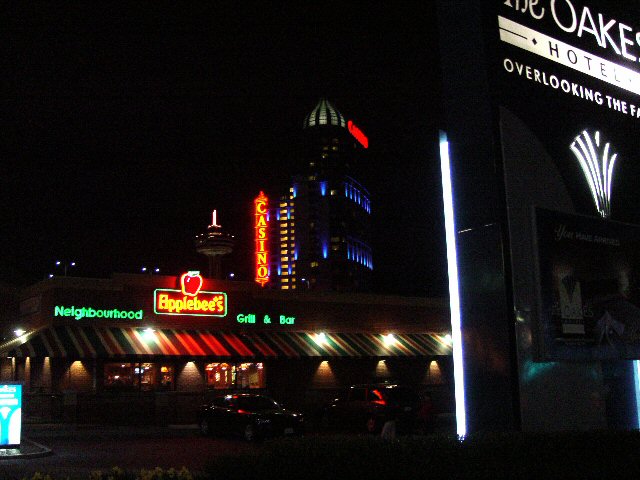
Image resolution: width=640 pixels, height=480 pixels. Find the location of `window`. window is located at coordinates (351, 195).